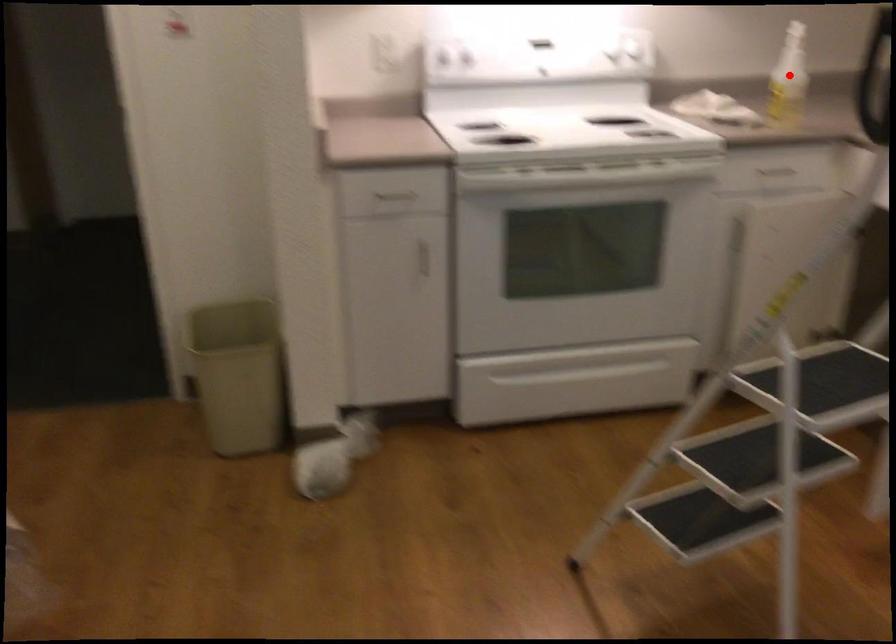
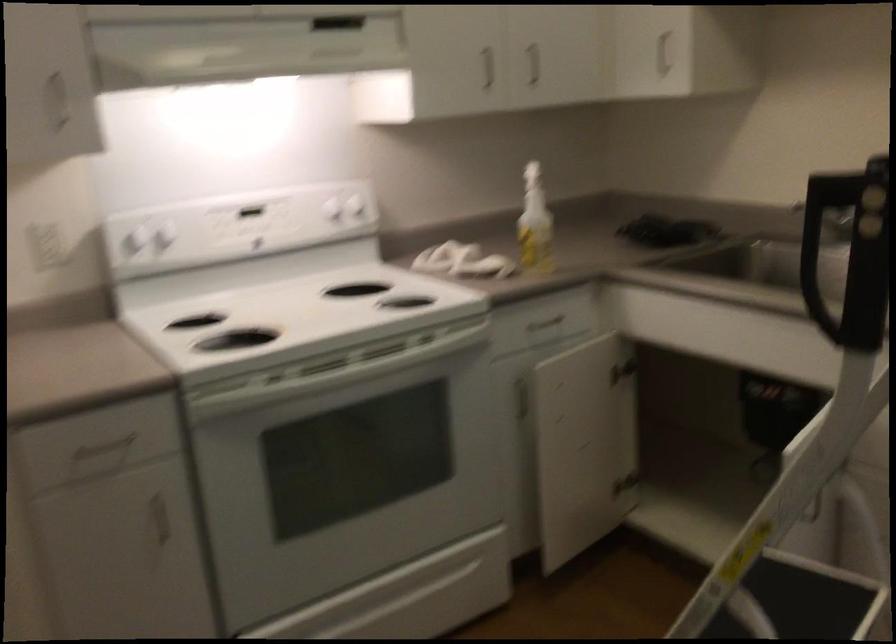
In the second image, find the point that corresponds to the highlighted location in the first image.

(535, 223)